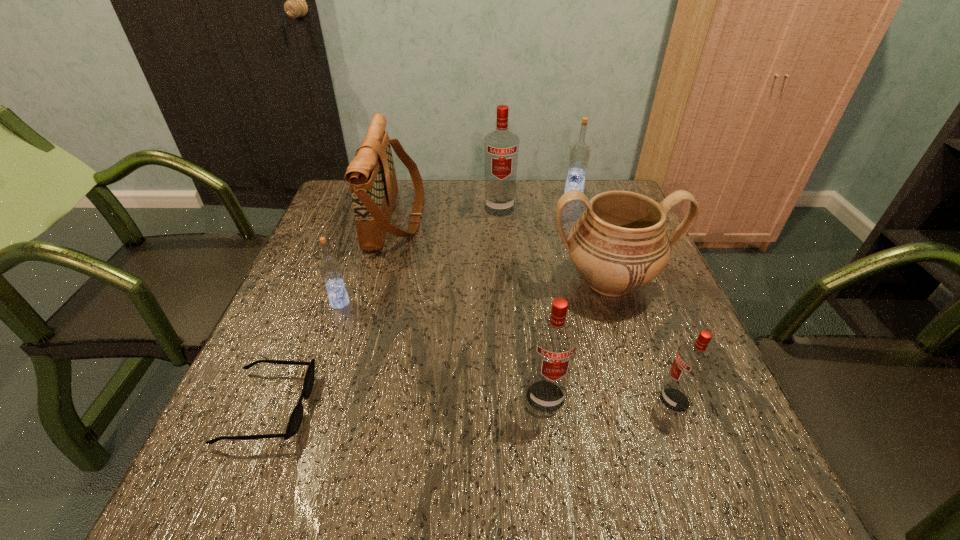
Find the location of a particular element. Image resolution: width=960 pixels, height=540 pixels. the farthest red vodka is located at coordinates (501, 147).

This screenshot has width=960, height=540. I want to click on the tallest object, so click(501, 147).

The image size is (960, 540). Find the location of `shoulder bag`. shoulder bag is located at coordinates (371, 174).

I want to click on the farthest vodka, so click(x=579, y=154).

Locate an element on the screen. the fourth vodka from left to right is located at coordinates (579, 154).

Where is `the second biggest red vodka`? This screenshot has width=960, height=540. the second biggest red vodka is located at coordinates (554, 341).

I want to click on urn, so point(619,244).

In order to click on the rightmost red vodka in this screenshot , I will do `click(693, 361)`.

Image resolution: width=960 pixels, height=540 pixels. What are the coordinates of `the smallest red vodka` in the screenshot? It's located at (693, 361).

Locate an element on the screen. This screenshot has height=540, width=960. the left blue vodka is located at coordinates (330, 268).